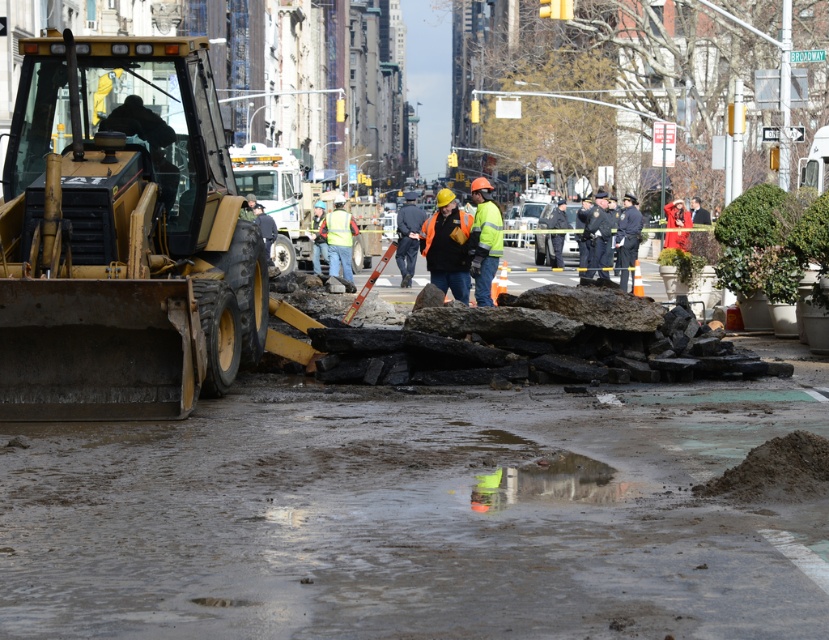
Question: Which object is closer to the camera taking this photo?

Choices:
 (A) orange reflective vest at center
 (B) yellow metallic excavator at left

Answer: (B)

Question: Considering the relative positions of yellow metallic excavator at left and orange reflective vest at center in the image provided, where is yellow metallic excavator at left located with respect to orange reflective vest at center?

Choices:
 (A) left
 (B) right

Answer: (A)

Question: Can you confirm if yellow metallic excavator at left is positioned below orange reflective vest at center?

Choices:
 (A) yes
 (B) no

Answer: (A)

Question: Is yellow metallic excavator at left wider than orange reflective vest at center?

Choices:
 (A) yes
 (B) no

Answer: (A)